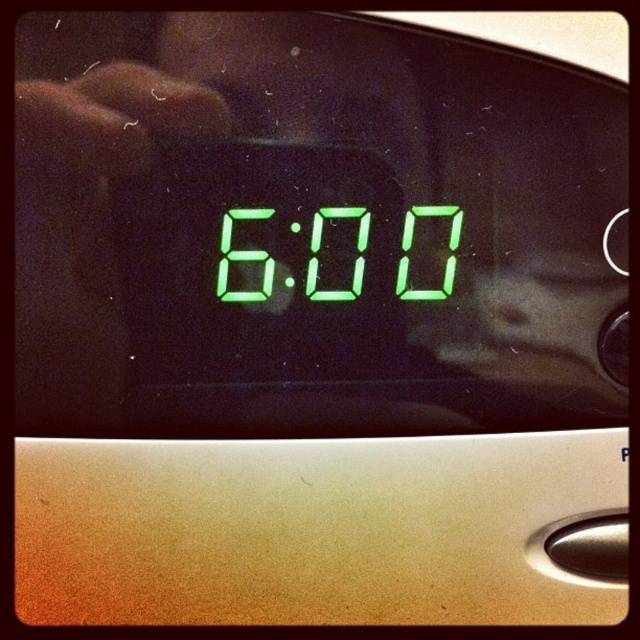
You are standing in front of the digital clock display showing 600 in bright green LED numerals. You notice two points marked in the image. The first point is at coordinate point (401, 234) and the second point is at coordinate point (253, 260). Which point is closer to you?

Point (401, 234) is in front of point (253, 260), so the first point is closer to you.

You are setting up an alarm clock for your morning routine. You notice the green digital display at center and the green digital at center. Which one is located below the other?

The green digital display at center is positioned under the green digital at center.

You are setting up an alarm clock in your room. You have two green digital devices in front of you. One is labeled as the green digital clock at center and the other as the green digital display at center. According to the image, which device is shorter in height?

The green digital clock at center is shorter than the green digital display at center.